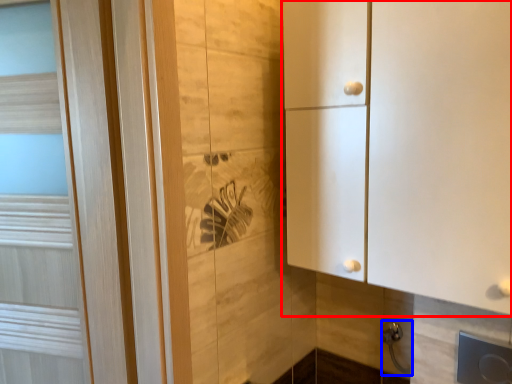
Question: Which of the following is the closest to the observer, cupboard (highlighted by a red box) or door handle (highlighted by a blue box)?

Choices:
 (A) cupboard
 (B) door handle

Answer: (A)